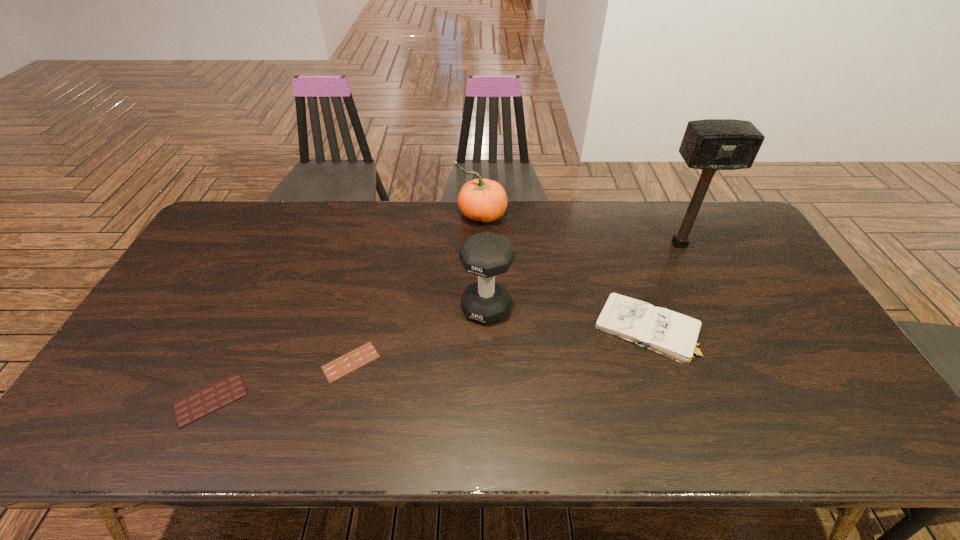
Where is `the tallest object`? the tallest object is located at coordinates (711, 144).

You are a GUI agent. You are given a task and a screenshot of the screen. Output one action in this format:
    pyautogui.click(x=<x>, y=<y>)
    Task: Click on the fifth nearest object
    
    Given the screenshot: What is the action you would take?
    pyautogui.click(x=711, y=144)

At what (x,y) coordinates should I click in order to perform the action: click on the farthest object. Please return your answer as a coordinate pair (x, y). This screenshot has height=540, width=960. Looking at the image, I should click on (484, 200).

Locate an element on the screen. Image resolution: width=960 pixels, height=540 pixels. dumbbell is located at coordinates (486, 254).

Identify the location of the fourth tallest object. (674, 335).

This screenshot has height=540, width=960. Find the location of `the left chocolate bar`. the left chocolate bar is located at coordinates (191, 408).

I want to click on the shortest object, so click(366, 353).

Find the location of a particular element. the second object from left to right is located at coordinates (366, 353).

In order to click on vacant space situated on the front of the mallet in this screenshot , I will do `click(710, 308)`.

At what (x,y) coordinates should I click in order to perform the action: click on vacant region located 0.330m on the left of the farthest object. Please return your answer as a coordinate pair (x, y). This screenshot has width=960, height=540. Looking at the image, I should click on (366, 215).